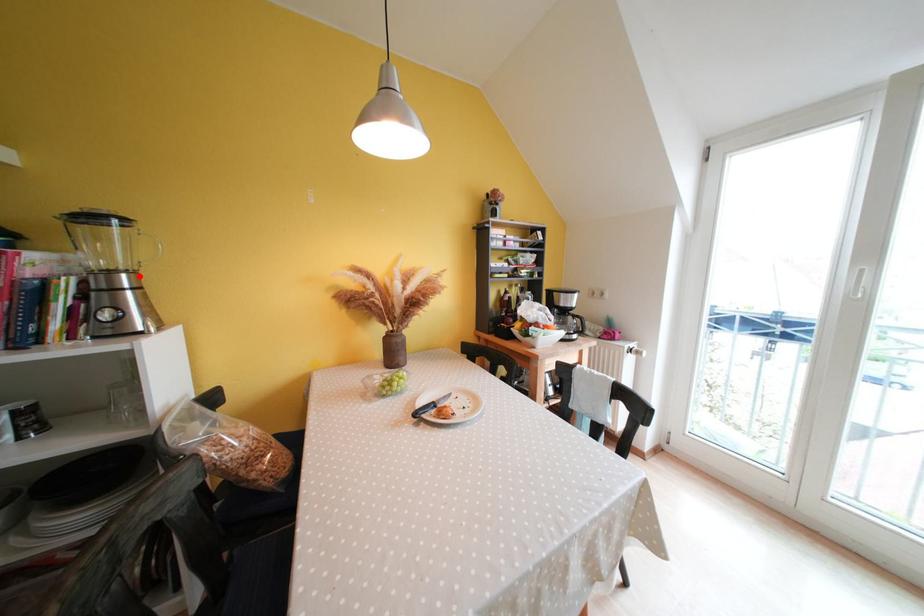
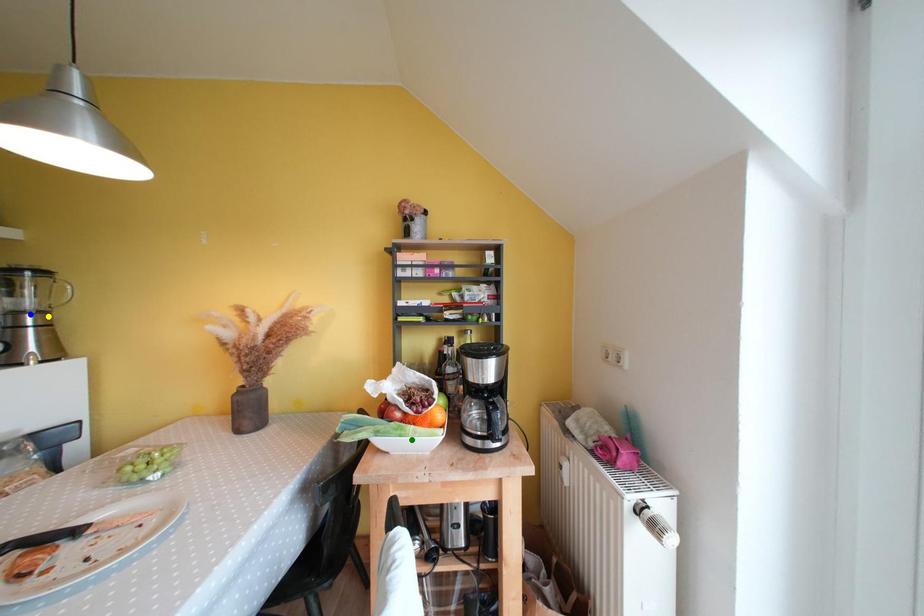
Question: I am providing you with two images of the same scene from different viewpoints. A red point is marked on the first image. You are given multiple points on the second image. Which point in image 2 represents the same 3d spot as the red point in image 1?

Choices:
 (A) blue point
 (B) green point
 (C) yellow point

Answer: (C)